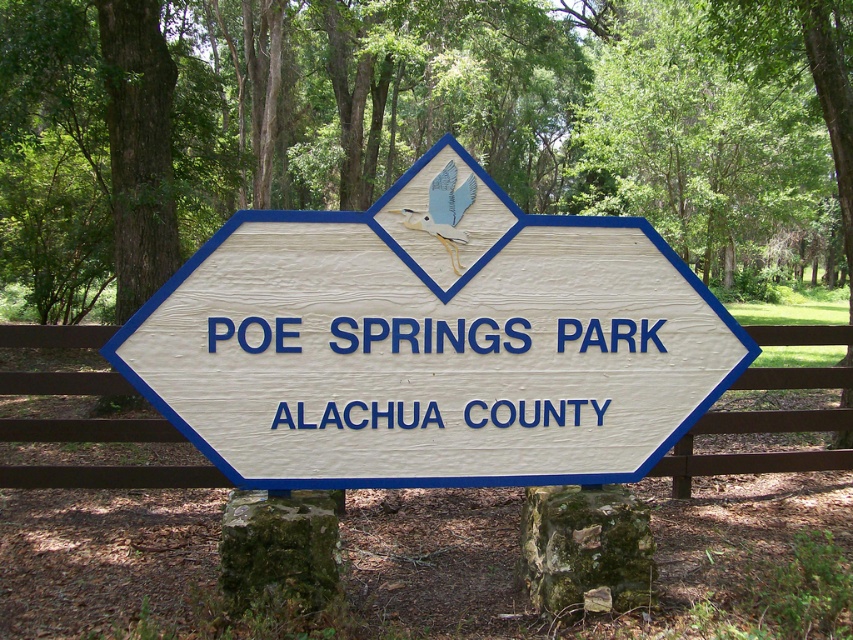
Is point (347, 240) farther from viewer compared to point (73, 472)?

No, (347, 240) is in front of (73, 472).

Does wooden sign at center have a larger size compared to brown wooden fence at center?

Correct, wooden sign at center is larger in size than brown wooden fence at center.

This screenshot has height=640, width=853. Describe the element at coordinates (431, 342) in the screenshot. I see `wooden sign at center` at that location.

Where is `wooden sign at center`? This screenshot has width=853, height=640. wooden sign at center is located at coordinates point(431,342).